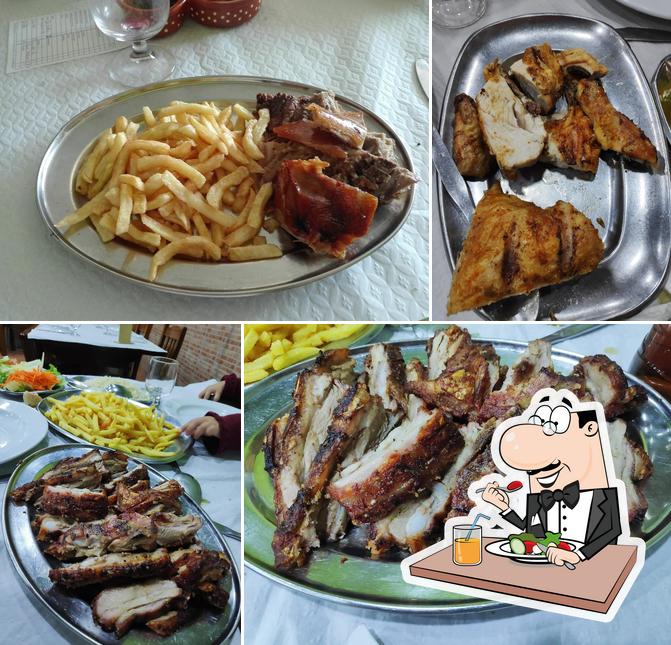
Find the location of a particular element. Image resolution: width=671 pixels, height=645 pixels. paper under plate is located at coordinates pyautogui.click(x=62, y=286).